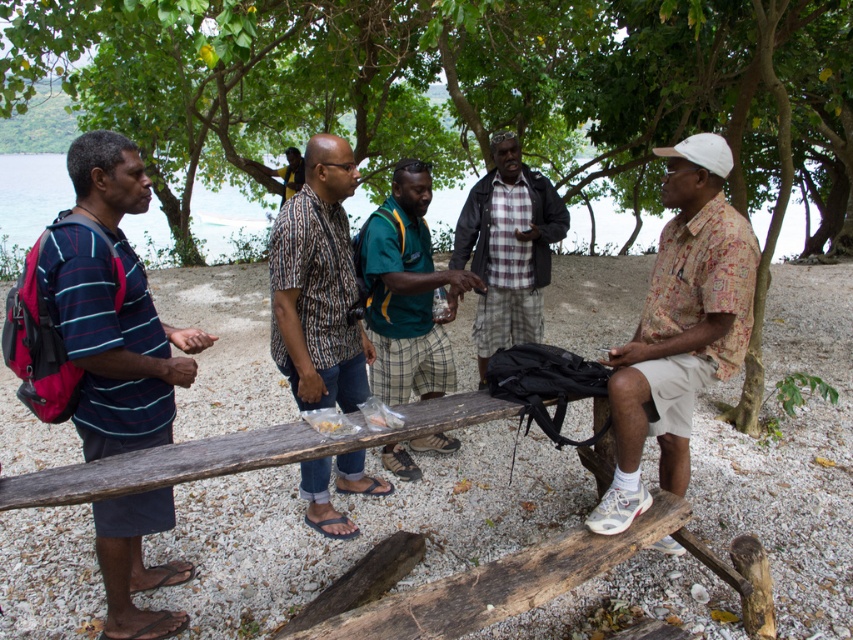
Question: Which point is farther to the camera?

Choices:
 (A) pos(416,440)
 (B) pos(727,589)
 (C) pos(477,225)

Answer: (C)

Question: Which point is farther from the camera taking this photo?

Choices:
 (A) (370, 348)
 (B) (401, 234)
 (C) (16, 392)

Answer: (B)

Question: Is printed cotton shirt at right thinner than green fabric shirt at center?

Choices:
 (A) yes
 (B) no

Answer: (B)

Question: In this image, where is printed cotton shirt at center located relative to green fabric shirt at center?

Choices:
 (A) above
 (B) below

Answer: (B)

Question: Is wooden bench at center behind plaid fabric shirt at center?

Choices:
 (A) no
 (B) yes

Answer: (A)

Question: Which object appears farthest from the camera in this image?

Choices:
 (A) printed cotton shirt at center
 (B) clear blue water at upper left
 (C) plaid fabric shirt at center
 (D) green leafy tree at upper center

Answer: (B)